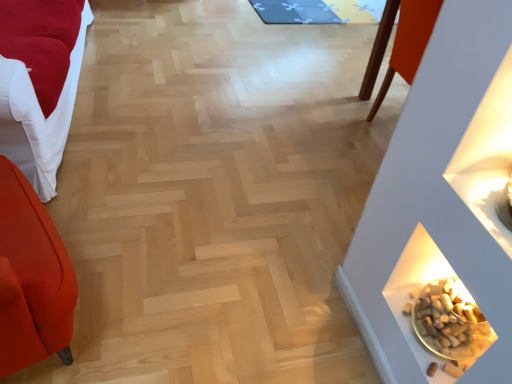
Question: Can you confirm if brown cork at lower right is thinner than blue fabric mat at upper center?

Choices:
 (A) yes
 (B) no

Answer: (A)

Question: Does brown cork at lower right have a larger size compared to blue fabric mat at upper center?

Choices:
 (A) no
 (B) yes

Answer: (A)

Question: From a real-world perspective, is brown cork at lower right positioned over blue fabric mat at upper center based on gravity?

Choices:
 (A) yes
 (B) no

Answer: (A)

Question: Is brown cork at lower right positioned behind blue fabric mat at upper center?

Choices:
 (A) yes
 (B) no

Answer: (B)

Question: Does brown cork at lower right have a smaller size compared to blue fabric mat at upper center?

Choices:
 (A) no
 (B) yes

Answer: (B)

Question: From their relative heights in the image, would you say velvet red sofa at left is taller or shorter than blue fabric mat at upper center?

Choices:
 (A) tall
 (B) short

Answer: (A)

Question: Would you say velvet red sofa at left is inside or outside blue fabric mat at upper center?

Choices:
 (A) outside
 (B) inside

Answer: (A)

Question: From a real-world perspective, is velvet red sofa at left physically located above or below blue fabric mat at upper center?

Choices:
 (A) above
 (B) below

Answer: (A)

Question: Looking at the image, does velvet red sofa at left seem bigger or smaller compared to blue fabric mat at upper center?

Choices:
 (A) big
 (B) small

Answer: (A)

Question: In terms of width, does velvet red sofa at left look wider or thinner when compared to brown cork at lower right?

Choices:
 (A) thin
 (B) wide

Answer: (B)

Question: From the image's perspective, relative to brown cork at lower right, is velvet red sofa at left above or below?

Choices:
 (A) above
 (B) below

Answer: (A)

Question: Is velvet red sofa at left bigger or smaller than brown cork at lower right?

Choices:
 (A) big
 (B) small

Answer: (A)

Question: From a real-world perspective, relative to brown cork at lower right, is velvet red sofa at left vertically above or below?

Choices:
 (A) below
 (B) above

Answer: (B)

Question: In the image, is brown cork at lower right positioned in front of or behind velvet red sofa at left?

Choices:
 (A) front
 (B) behind

Answer: (B)

Question: From the image's perspective, is brown cork at lower right positioned above or below velvet red sofa at left?

Choices:
 (A) below
 (B) above

Answer: (A)